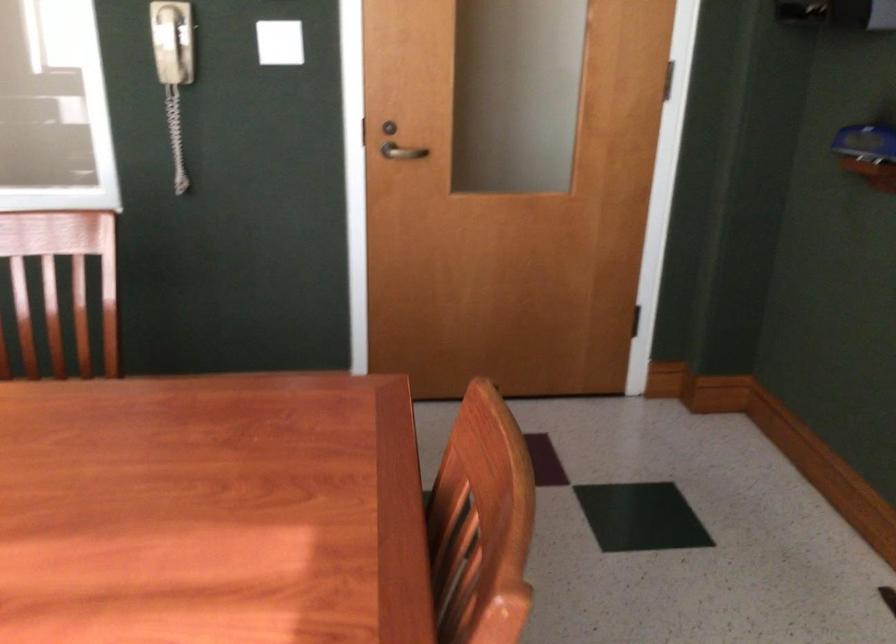
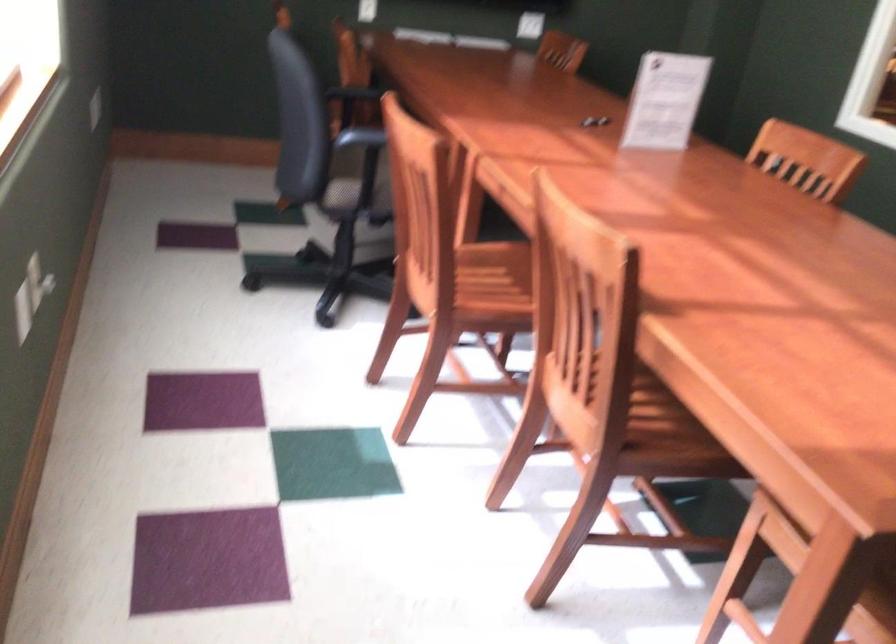
The images are taken continuously from a first-person perspective. In which direction is your viewpoint rotating?

The camera rotated toward left-down.